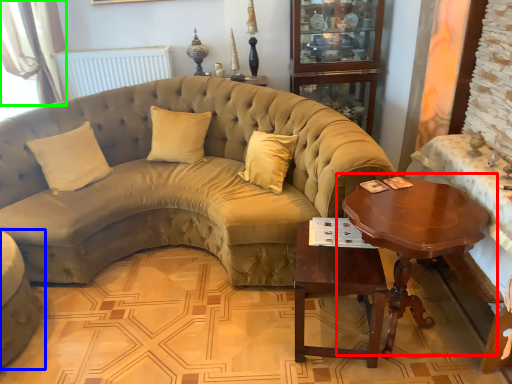
Question: Estimate the real-world distances between objects in this image. Which object is closer to coffee table (highlighted by a red box), studio couch (highlighted by a blue box) or curtain (highlighted by a green box)?

Choices:
 (A) studio couch
 (B) curtain

Answer: (A)